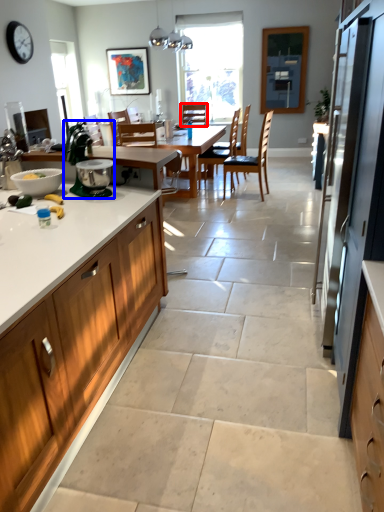
Question: Which object appears closest to the camera in this image, chair (highlighted by a red box) or appliance (highlighted by a blue box)?

Choices:
 (A) chair
 (B) appliance

Answer: (B)